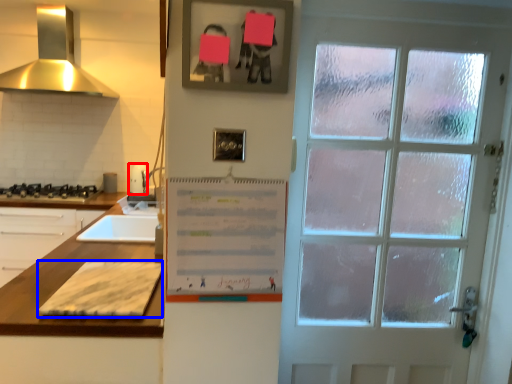
Question: Among these objects, which one is nearest to the camera, appliance (highlighted by a red box) or cardboard (highlighted by a blue box)?

Choices:
 (A) appliance
 (B) cardboard

Answer: (B)